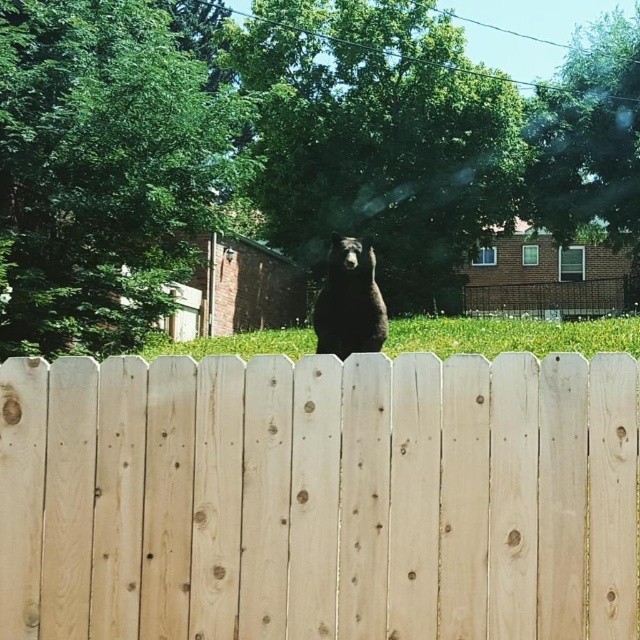
Question: Can you confirm if light brown wood fence at center is positioned above black furry bear at center?

Choices:
 (A) yes
 (B) no

Answer: (B)

Question: Which of the following is the farthest from the observer?

Choices:
 (A) black furry bear at center
 (B) light brown wood fence at center

Answer: (A)

Question: Which of the following is the farthest from the observer?

Choices:
 (A) black furry bear at center
 (B) light brown wood fence at center

Answer: (A)

Question: Can you confirm if light brown wood fence at center is wider than black furry bear at center?

Choices:
 (A) yes
 (B) no

Answer: (A)

Question: Which object appears closest to the camera in this image?

Choices:
 (A) light brown wood fence at center
 (B) black furry bear at center

Answer: (A)

Question: Is light brown wood fence at center below black furry bear at center?

Choices:
 (A) yes
 (B) no

Answer: (A)